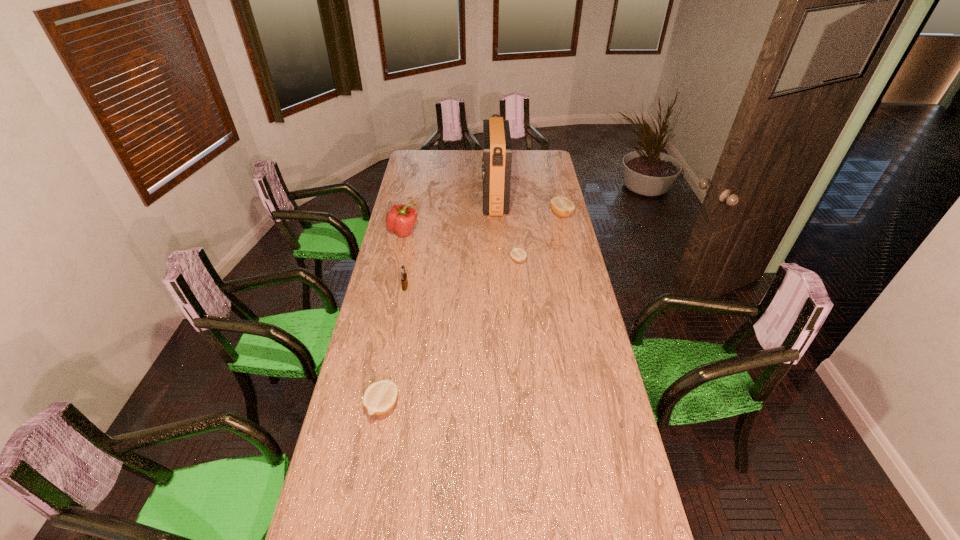
To make them evenly spaced by inserting another lemon among them, please locate a vacant spot for this new lemon. Please provide its 2D coordinates. Your answer should be formatted as a tuple, i.e. [(x, y)], where the tuple contains the x and y coordinates of a point satisfying the conditions above.

[(461, 321)]